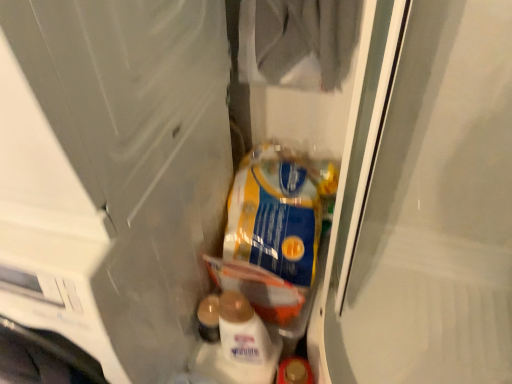
Question: Considering the positions of transparent plastic screen door at left, marked as the 1th screen door in a left-to-right arrangement, and blue/yellow plastic bag at center in the image, is transparent plastic screen door at left, marked as the 1th screen door in a left-to-right arrangement, wider or thinner than blue/yellow plastic bag at center?

Choices:
 (A) wide
 (B) thin

Answer: (A)

Question: Is point (117, 292) closer or farther from the camera than point (272, 173)?

Choices:
 (A) farther
 (B) closer

Answer: (B)

Question: Which is nearer to the blue/yellow plastic bag at center?

Choices:
 (A) transparent plastic screen door at left, which is the second screen door in right-to-left order
 (B) clear plastic bag at center, marked as the first screen door in a right-to-left arrangement

Answer: (B)

Question: Which is farther from the transparent plastic screen door at left, marked as the 1th screen door in a left-to-right arrangement?

Choices:
 (A) clear plastic bag at center, marked as the first screen door in a right-to-left arrangement
 (B) blue/yellow plastic bag at center

Answer: (A)